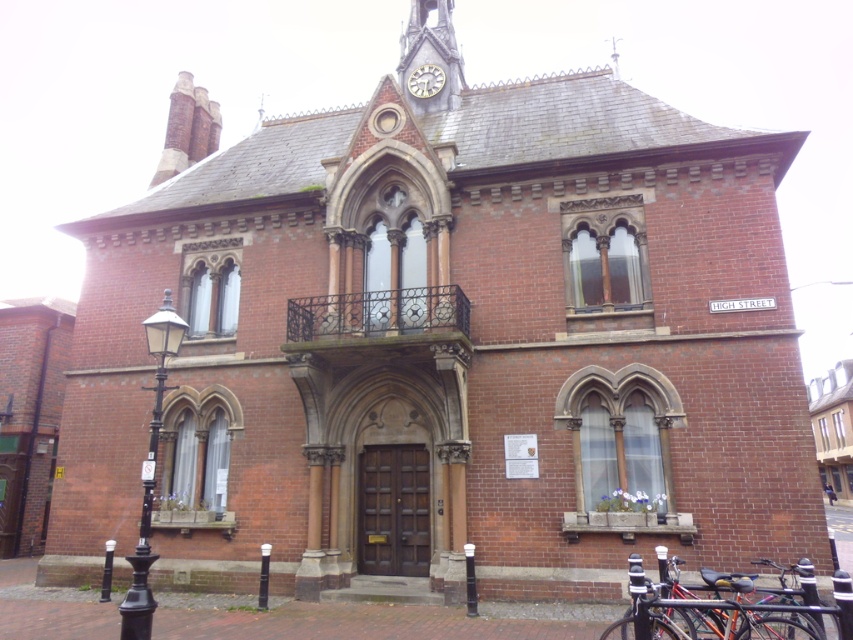
You are a tourist standing in front of the historic brick building on High Street. You notice the shiny black bicycle at lower right and the gold metallic clock at upper center. Which object would appear larger to you from your current viewpoint?

The shiny black bicycle at lower right appears larger than the gold metallic clock at upper center because it is bigger in size.

From the picture: You are a delivery person standing next to the shiny black bicycle at lower right. You need to deliver a package to the gold metallic clock at upper center. Can you walk directly to it without moving around any obstacles?

The distance between the shiny black bicycle at lower right and the gold metallic clock at upper center is 41.95 meters. However, the scene does not mention any obstacles between them, so you can walk directly to it.

Based on the photo, you are a tourist standing on High Street facing the historic brick building. You notice a shiny black bicycle at lower right and a gold metallic clock at upper center. Which object is positioned more to the east side of the building?

The shiny black bicycle at lower right is positioned more to the east side of the building because it is to the right of the gold metallic clock at upper center, and since you are facing the building on High Street, right corresponds to east.